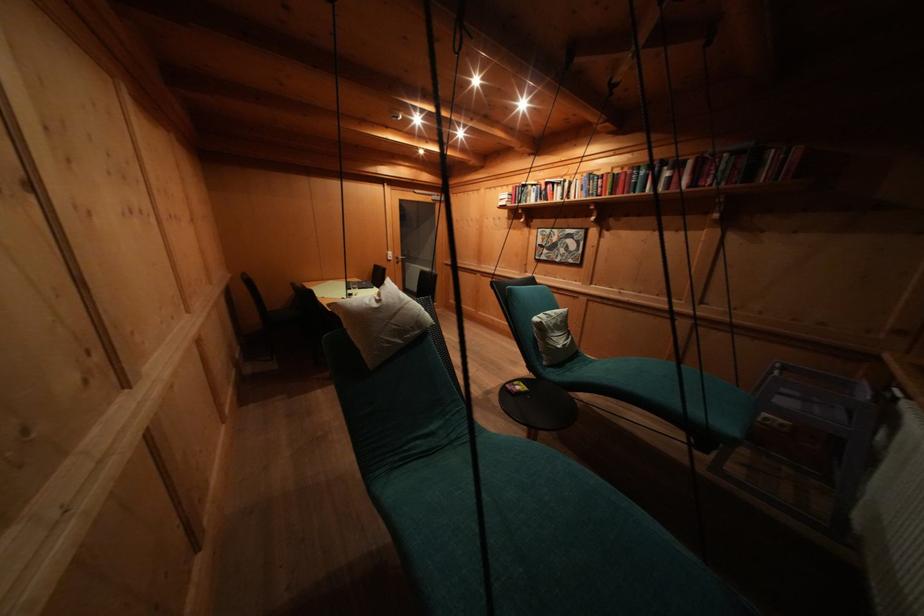
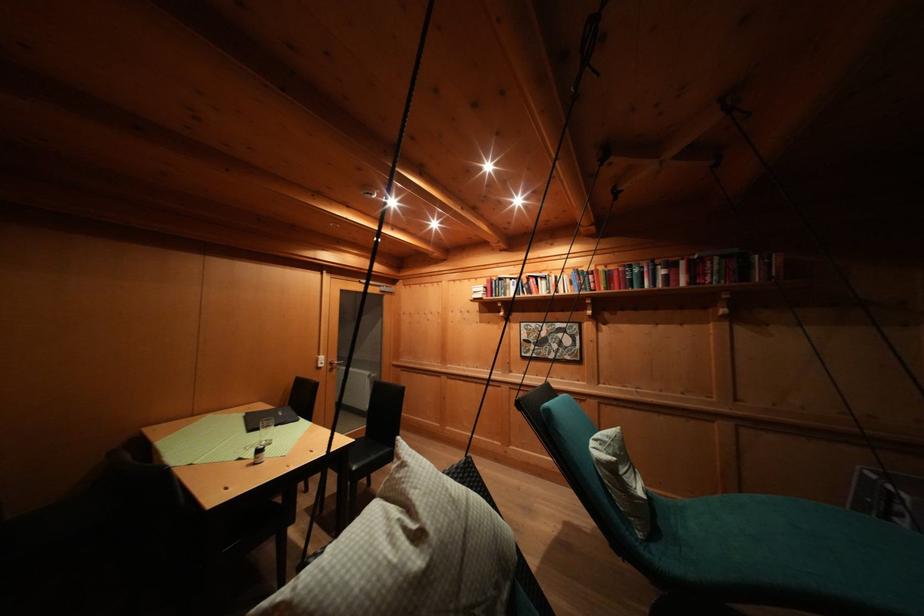
In the second image, find the point that corresponds to [536,192] in the first image.

(514, 285)